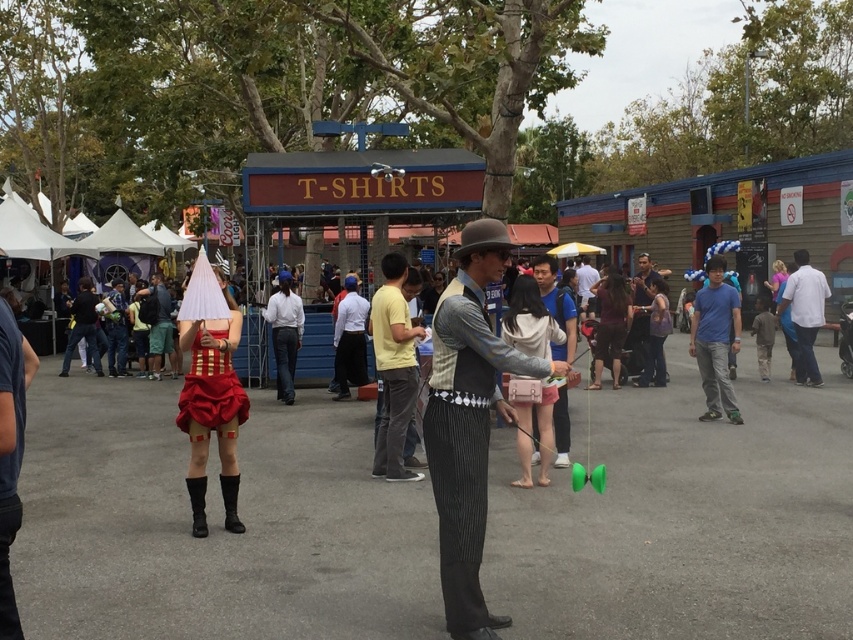
Does blue cotton shirt at center have a smaller size compared to white shirt at right?

Correct, blue cotton shirt at center occupies less space than white shirt at right.

The width and height of the screenshot is (853, 640). What do you see at coordinates (715, 340) in the screenshot?
I see `blue cotton shirt at center` at bounding box center [715, 340].

This screenshot has height=640, width=853. I want to click on blue cotton shirt at center, so click(x=715, y=340).

Is silver metallic vest at center further to the viewer compared to blue cotton shirt at center?

No.

Is silver metallic vest at center shorter than blue cotton shirt at center?

No.

Is point (445, 305) in front of point (706, 316)?

Yes, it is.

The width and height of the screenshot is (853, 640). What are the coordinates of `silver metallic vest at center` in the screenshot? It's located at (468, 420).

Does silver metallic vest at center appear under yellow cotton shirt at center?

Correct, silver metallic vest at center is located below yellow cotton shirt at center.

Is silver metallic vest at center wider than yellow cotton shirt at center?

Yes, silver metallic vest at center is wider than yellow cotton shirt at center.

You are a GUI agent. You are given a task and a screenshot of the screen. Output one action in this format:
    pyautogui.click(x=<x>, y=<y>)
    Task: Click on the silver metallic vest at center
    
    Given the screenshot: What is the action you would take?
    pos(468,420)